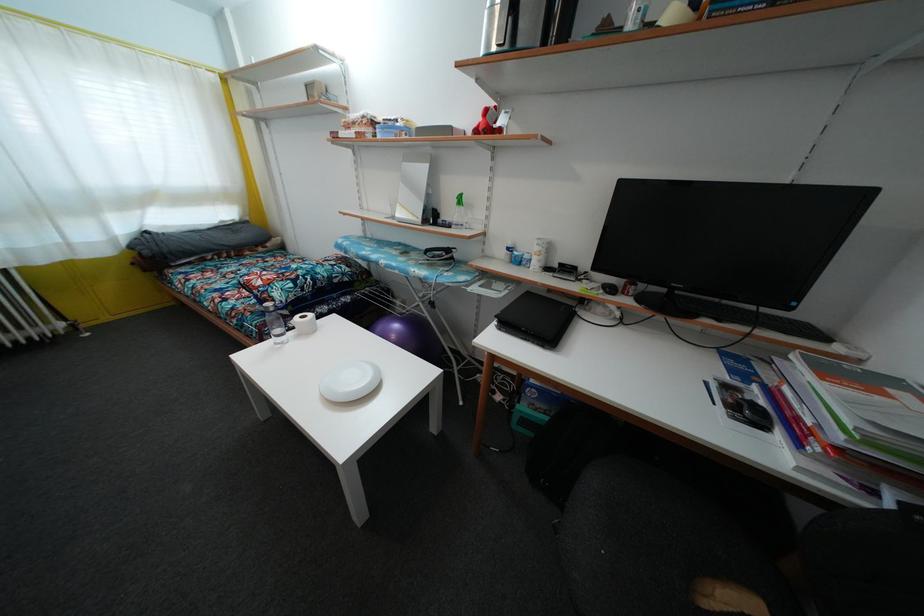
Where is `small frameless mirror`? Image resolution: width=924 pixels, height=616 pixels. small frameless mirror is located at coordinates (411, 185).